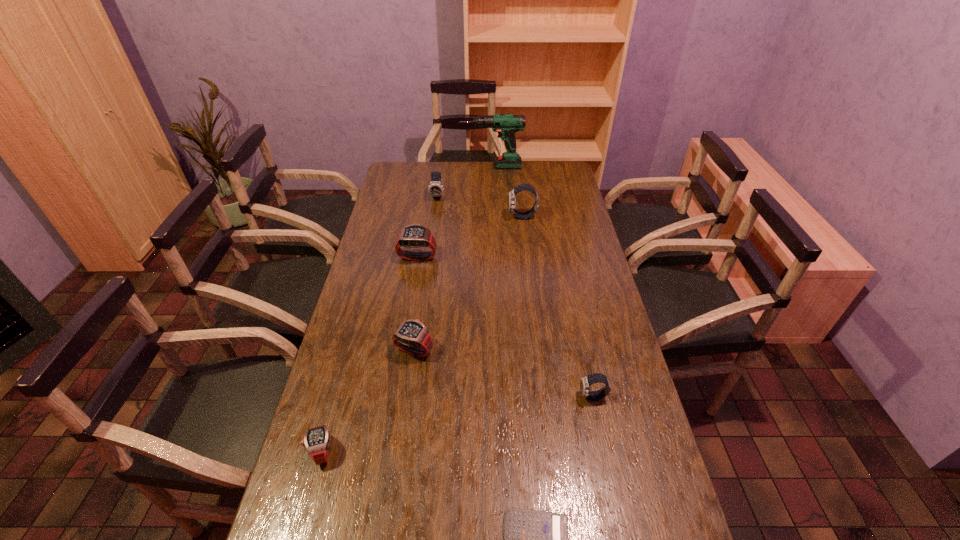
You are a GUI agent. You are given a task and a screenshot of the screen. Output one action in this format:
    pyautogui.click(x=<x>, y=<y>)
    Task: Click on the object that ranks as the fifth closest to the farthest dark watch
    The width and height of the screenshot is (960, 540).
    Given the screenshot: What is the action you would take?
    pyautogui.click(x=585, y=382)

Locate which watch is the third closest to the second smallest dark watch. Please provide its 2D coordinates. Your answer should be formatted as a tuple, i.e. [(x, y)], where the tuple contains the x and y coordinates of a point satisfying the conditions above.

[(412, 336)]

Where is `watch that is the fourth closest to the shortest object`? This screenshot has height=540, width=960. watch that is the fourth closest to the shortest object is located at coordinates (415, 235).

Choose which dark watch is the second nearest neighbor to the second nearest watch. Please provide its 2D coordinates. Your answer should be formatted as a tuple, i.e. [(x, y)], where the tuple contains the x and y coordinates of a point satisfying the conditions above.

[(435, 188)]

Find the location of a particular element. The width and height of the screenshot is (960, 540). dark watch that is the second closest to the smallest dark watch is located at coordinates (435, 188).

This screenshot has width=960, height=540. What are the coordinates of `red watch that stands as the closest to the leftmost watch` in the screenshot? It's located at (412, 336).

This screenshot has width=960, height=540. I want to click on red watch that can be found as the second closest to the second biggest dark watch, so click(x=412, y=336).

This screenshot has width=960, height=540. I want to click on free region that satisfies the following two spatial constraints: 1. on the face of the sixth nearest object; 2. on the front side of the second smallest red watch, so click(539, 350).

Where is `free spot that satisfies the following two spatial constraints: 1. on the front side of the fifth nearest object; 2. on the left side of the fourth nearest object`? Image resolution: width=960 pixels, height=540 pixels. free spot that satisfies the following two spatial constraints: 1. on the front side of the fifth nearest object; 2. on the left side of the fourth nearest object is located at coordinates point(402,350).